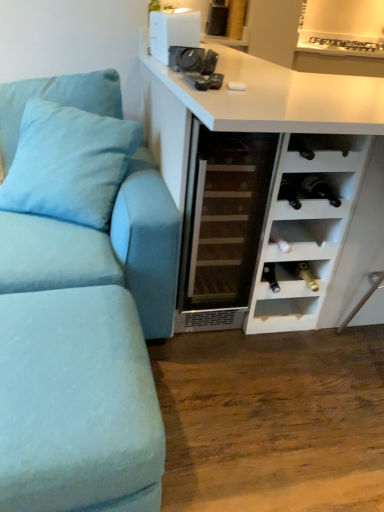
What do you see at coordinates (173, 32) in the screenshot? The height and width of the screenshot is (512, 384). I see `white plastic speaker at upper center` at bounding box center [173, 32].

Where is `black glass wine bottles at lower right, the 2th shelf positioned from the top`? black glass wine bottles at lower right, the 2th shelf positioned from the top is located at coordinates (312, 194).

The height and width of the screenshot is (512, 384). Describe the element at coordinates (312, 194) in the screenshot. I see `black glass wine bottles at lower right, the 3th shelf when ordered from bottom to top` at that location.

I want to click on white matte wine cabinet at center, so click(x=270, y=161).

What do you see at coordinates (80, 298) in the screenshot? The width and height of the screenshot is (384, 512). I see `light blue fabric couch at left` at bounding box center [80, 298].

At what (x,y) coordinates should I click in order to perform the action: click on black matte wine bottle at lower right, the 4th shelf when ordered from top to bottom. Please return your answer as a coordinate pair (x, y). Looking at the image, I should click on (293, 277).

At what (x,y) coordinates should I click in order to perform the action: click on white plastic speaker at upper center. Please return your answer as a coordinate pair (x, y). Looking at the image, I should click on tap(173, 32).

Locate an element on the screen. the 1st shelf directly beneath the white matte wine cabinet at center (from a real-world perspective) is located at coordinates coord(304,239).

From the picture: From the image's perspective, which object appears higher, white matte wine cabinet at center or matte white shelf at lower right, positioned as the 3th shelf in top-to-bottom order?

white matte wine cabinet at center, from the image's perspective.

Would you say white matte wine cabinet at center is to the left or to the right of matte white shelf at lower right, which appears as the second shelf when ordered from the bottom, in the picture?

white matte wine cabinet at center is positioned on matte white shelf at lower right, which appears as the second shelf when ordered from the bottom,'s right side.

Who is bigger, white matte wine cabinet at center or matte white shelf at lower right, positioned as the 3th shelf in top-to-bottom order?

Bigger between the two is white matte wine cabinet at center.

Where is `shelf lying above the black glass wine bottles at lower right, the 2th shelf positioned from the top (from the image's perspective)`? shelf lying above the black glass wine bottles at lower right, the 2th shelf positioned from the top (from the image's perspective) is located at coordinates (323, 152).

From the image's perspective, which is above, white matte wine rack at right, the fourth shelf ordered from the bottom, or black glass wine bottles at lower right, the 3th shelf when ordered from bottom to top?

From the image's view, white matte wine rack at right, the fourth shelf ordered from the bottom, is above.

Consider the image. Is white matte wine rack at right, the fourth shelf ordered from the bottom, inside the boundaries of black glass wine bottles at lower right, the 3th shelf when ordered from bottom to top, or outside?

white matte wine rack at right, the fourth shelf ordered from the bottom, is not inside black glass wine bottles at lower right, the 3th shelf when ordered from bottom to top, it's outside.

Is point (225, 278) positioned behind point (319, 233)?

That is True.

Is transparent glass wine cooler at center bigger or smaller than matte white shelf at lower right, which appears as the second shelf when ordered from the bottom?

Clearly, transparent glass wine cooler at center is larger in size than matte white shelf at lower right, which appears as the second shelf when ordered from the bottom.

In order to click on shelf that is the 2nd one when counting rightward from the transparent glass wine cooler at center in this screenshot , I will do `click(304, 239)`.

Which of these two, transparent glass wine cooler at center or matte white shelf at lower right, which appears as the second shelf when ordered from the bottom, stands shorter?

With less height is matte white shelf at lower right, which appears as the second shelf when ordered from the bottom.

Is white plastic speaker at upper center not within white matte wine rack at right, placed as the 1th shelf when sorted from top to bottom?

Yes, white plastic speaker at upper center is not within white matte wine rack at right, placed as the 1th shelf when sorted from top to bottom.

Considering the relative sizes of white plastic speaker at upper center and white matte wine rack at right, placed as the 1th shelf when sorted from top to bottom, in the image provided, is white plastic speaker at upper center wider than white matte wine rack at right, placed as the 1th shelf when sorted from top to bottom,?

No.

Is white plastic speaker at upper center far away from white matte wine rack at right, placed as the 1th shelf when sorted from top to bottom?

No, there isn't a large distance between white plastic speaker at upper center and white matte wine rack at right, placed as the 1th shelf when sorted from top to bottom.

How far apart are white plastic speaker at upper center and white matte wine rack at right, the fourth shelf ordered from the bottom?

26.34 inches.

Starting from the black matte wine bottle at lower right, which appears as the first shelf when ordered from the bottom, which shelf is the 1st one in front? Please provide its 2D coordinates.

[(304, 239)]

Based on the photo, is matte white shelf at lower right, positioned as the 3th shelf in top-to-bottom order, turned away from black matte wine bottle at lower right, the 4th shelf when ordered from top to bottom?

No, matte white shelf at lower right, positioned as the 3th shelf in top-to-bottom order, is not facing away from black matte wine bottle at lower right, the 4th shelf when ordered from top to bottom.

Between matte white shelf at lower right, which appears as the second shelf when ordered from the bottom, and black matte wine bottle at lower right, the 4th shelf when ordered from top to bottom, which one appears on the left side from the viewer's perspective?

black matte wine bottle at lower right, the 4th shelf when ordered from top to bottom, is more to the left.

Does point (276, 244) lie in front of point (308, 264)?

Yes, it is in front of point (308, 264).

How many degrees apart are the facing directions of light blue fabric couch at left and black matte wine bottle at lower right, which appears as the first shelf when ordered from the bottom?

They differ by 1.63 degrees in their facing directions.

From a real-world perspective, does light blue fabric couch at left stand above black matte wine bottle at lower right, which appears as the first shelf when ordered from the bottom?

Correct, in the physical world, light blue fabric couch at left is higher than black matte wine bottle at lower right, which appears as the first shelf when ordered from the bottom.

Which is more to the left, light blue fabric couch at left or black matte wine bottle at lower right, the 4th shelf when ordered from top to bottom?

From the viewer's perspective, light blue fabric couch at left appears more on the left side.

From the image's perspective, is light blue fabric couch at left over black matte wine bottle at lower right, the 4th shelf when ordered from top to bottom?

Correct, light blue fabric couch at left appears higher than black matte wine bottle at lower right, the 4th shelf when ordered from top to bottom, in the image.

Between point (332, 159) and point (152, 113), which one is positioned behind?

The point (152, 113) is more distant.

Which is correct: white matte wine rack at right, placed as the 1th shelf when sorted from top to bottom, is inside white matte wine cabinet at center, or outside of it?

white matte wine rack at right, placed as the 1th shelf when sorted from top to bottom, is spatially positioned inside white matte wine cabinet at center.

Does white matte wine rack at right, the fourth shelf ordered from the bottom, touch white matte wine cabinet at center?

No, white matte wine rack at right, the fourth shelf ordered from the bottom, is not touching white matte wine cabinet at center.

Which shelf is the 1st one when counting from the left side of the white matte wine cabinet at center? Please provide its 2D coordinates.

[(323, 152)]

From a real-world perspective, which shelf is the 1st one underneath the white matte wine cabinet at center? Please provide its 2D coordinates.

[(304, 239)]

Identify the location of the 1st shelf below the white matte wine rack at right, the fourth shelf ordered from the bottom (from the image's perspective). (312, 194).

Considering their positions, is black glass wine bottles at lower right, the 3th shelf when ordered from bottom to top, positioned closer to white matte wine cabinet at center than white matte wine rack at right, the fourth shelf ordered from the bottom?

white matte wine rack at right, the fourth shelf ordered from the bottom, is positioned closer to the anchor white matte wine cabinet at center.

From the image, which object appears to be farther from white matte wine cabinet at center, light blue fabric couch at left or transparent glass wine cooler at center?

light blue fabric couch at left lies further to white matte wine cabinet at center than the other object.

Considering their positions, is white matte wine rack at right, placed as the 1th shelf when sorted from top to bottom, positioned further to light blue fabric pillow at left than matte white shelf at lower right, which appears as the second shelf when ordered from the bottom?

The object further to light blue fabric pillow at left is matte white shelf at lower right, which appears as the second shelf when ordered from the bottom.

Looking at this image, looking at the image, which one is located closer to black matte wine bottle at lower right, which appears as the first shelf when ordered from the bottom, white matte wine rack at right, the fourth shelf ordered from the bottom, or white plastic speaker at upper center?

Among the two, white matte wine rack at right, the fourth shelf ordered from the bottom, is located nearer to black matte wine bottle at lower right, which appears as the first shelf when ordered from the bottom.

When comparing their distances from black glass wine bottles at lower right, the 3th shelf when ordered from bottom to top, does white plastic speaker at upper center or white matte wine rack at right, the fourth shelf ordered from the bottom, seem closer?

white matte wine rack at right, the fourth shelf ordered from the bottom, lies closer to black glass wine bottles at lower right, the 3th shelf when ordered from bottom to top, than the other object.

Which object lies nearer to the anchor point white matte wine cabinet at center, transparent glass wine cooler at center or matte white shelf at lower right, which appears as the second shelf when ordered from the bottom?

transparent glass wine cooler at center lies closer to white matte wine cabinet at center than the other object.

Estimate the real-world distances between objects in this image. Which object is further from transparent glass wine cooler at center, white matte wine rack at right, the fourth shelf ordered from the bottom, or white matte wine cabinet at center?

white matte wine rack at right, the fourth shelf ordered from the bottom, is further to transparent glass wine cooler at center.

Considering their positions, is matte white shelf at lower right, positioned as the 3th shelf in top-to-bottom order, positioned closer to black glass wine bottles at lower right, the 3th shelf when ordered from bottom to top, than white plastic speaker at upper center?

matte white shelf at lower right, positioned as the 3th shelf in top-to-bottom order, is positioned closer to the anchor black glass wine bottles at lower right, the 3th shelf when ordered from bottom to top.

You are a GUI agent. You are given a task and a screenshot of the screen. Output one action in this format:
    pyautogui.click(x=<x>, y=<y>)
    Task: Click on the studio couch situated between light blue fabric pillow at left and white matte wine cabinet at center from left to right
    The height and width of the screenshot is (512, 384).
    Given the screenshot: What is the action you would take?
    pyautogui.click(x=80, y=298)

At what (x,y) coordinates should I click in order to perform the action: click on glass door located between light blue fabric couch at left and white matte wine cabinet at center in the left-right direction. Please return your answer as a coordinate pair (x, y). The height and width of the screenshot is (512, 384). Looking at the image, I should click on (222, 226).

Find the location of a particular element. Image resolution: width=384 pixels, height=512 pixels. glass door between white plastic speaker at upper center and black matte wine bottle at lower right, the 4th shelf when ordered from top to bottom, from top to bottom is located at coordinates (222, 226).

Image resolution: width=384 pixels, height=512 pixels. I want to click on cabinetry between white plastic speaker at upper center and black matte wine bottle at lower right, the 4th shelf when ordered from top to bottom, in the vertical direction, so click(x=270, y=161).